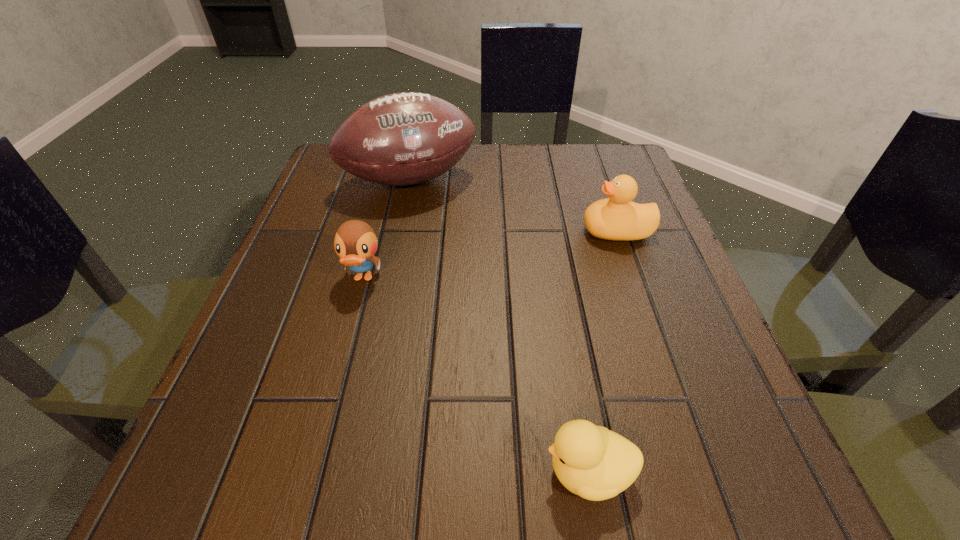
At what (x,y) coordinates should I click in order to perform the action: click on the closest duck to the farthest duck. Please return your answer as a coordinate pair (x, y). The image size is (960, 540). Looking at the image, I should click on [x=593, y=462].

Identify the location of duck that is the nearest to the nearest object. (355, 242).

Find the location of a particular element. The image size is (960, 540). free space that satisfies the following two spatial constraints: 1. on the face of the farthest duck; 2. on the front-facing side of the second nearest object is located at coordinates (634, 278).

This screenshot has width=960, height=540. In order to click on free space that satisfies the following two spatial constraints: 1. on the face of the rightmost object; 2. on the front-facing side of the third farthest object in this screenshot , I will do `click(634, 278)`.

I want to click on vacant area that satisfies the following two spatial constraints: 1. on the face of the second farthest object; 2. on the front-facing side of the third farthest object, so click(x=634, y=278).